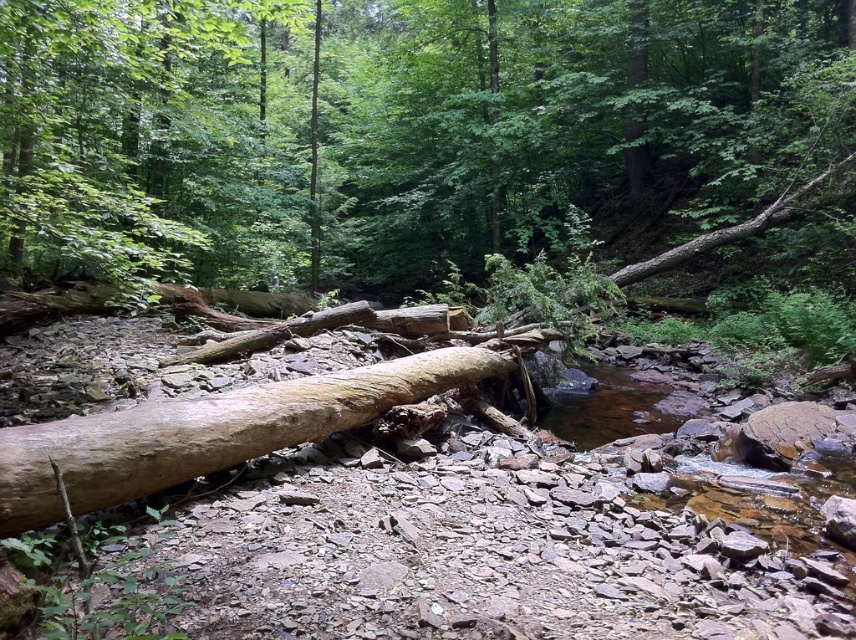
You are a hiker trying to cross the stream in the forest. You see two logs, the brown rough log at center and the light brown wood log at center. Which log is closer to your left side when facing the stream?

The brown rough log at center is positioned on the left side of light brown wood log at center, so when facing the stream, the brown rough log at center would be closer to your left side.

You are a hiker trying to cross the stream in the forest. You see two logs, the brown rough log at center and the light brown wood log at center. Which log is closer to you and safer to step on first?

The brown rough log at center is closer to you and safer to step on first because it is positioned further to the viewer than the light brown wood log at center.

You are standing at the point marked as point (397, 129) in the forest scene. What object is located exactly at that point?

The brown rough log at center is located exactly at point (397, 129).